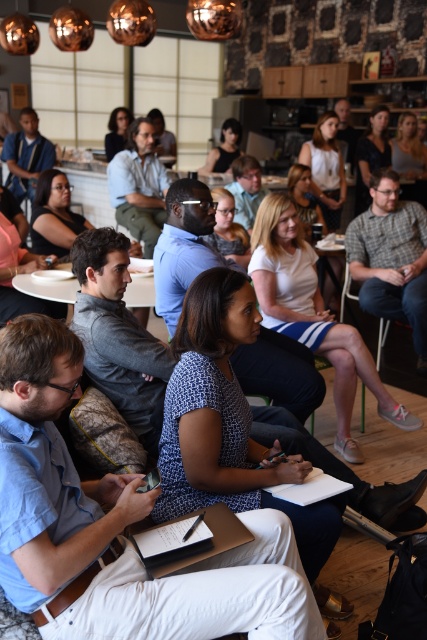
Question: Estimate the real-world distances between objects in this image. Which object is farther from the white cotton skirt at center?

Choices:
 (A) matte black hair at upper right
 (B) white cotton shirt at upper center

Answer: (A)

Question: Which point is closer to the camera?

Choices:
 (A) matte gray shirt at center
 (B) gray plaid shirt at center

Answer: (B)

Question: Can you confirm if blue printed shirt at center is thinner than matte gray shirt at center?

Choices:
 (A) no
 (B) yes

Answer: (A)

Question: Is matte blue shirt at upper left bigger than matte black laptop at upper center?

Choices:
 (A) yes
 (B) no

Answer: (A)

Question: From the image, what is the correct spatial relationship of matte black hair at center in relation to matte black hair at upper right?

Choices:
 (A) left
 (B) right

Answer: (A)

Question: Which point is closer to the camera?

Choices:
 (A) matte black laptop at left
 (B) matte white shirt at center
 (C) matte black glasses at center

Answer: (A)